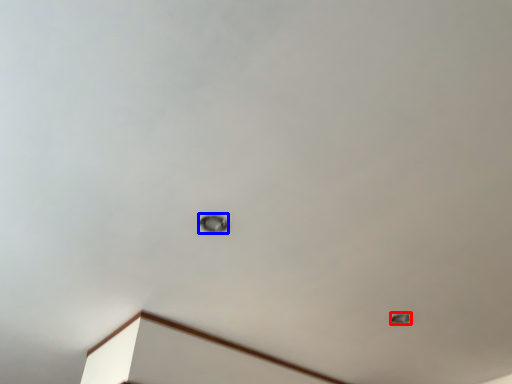
Question: Which of the following is the closest to the observer, lamp (highlighted by a red box) or lamp (highlighted by a blue box)?

Choices:
 (A) lamp
 (B) lamp

Answer: (B)